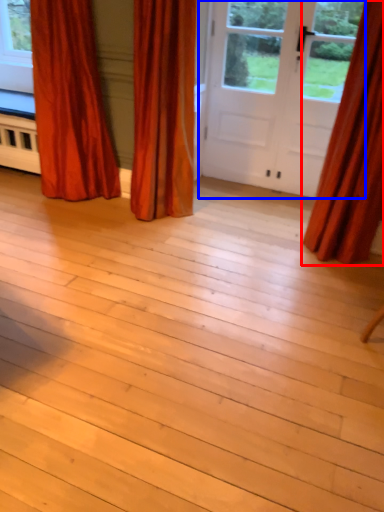
Question: Which object appears closest to the camera in this image, curtain (highlighted by a red box) or door (highlighted by a blue box)?

Choices:
 (A) curtain
 (B) door

Answer: (A)